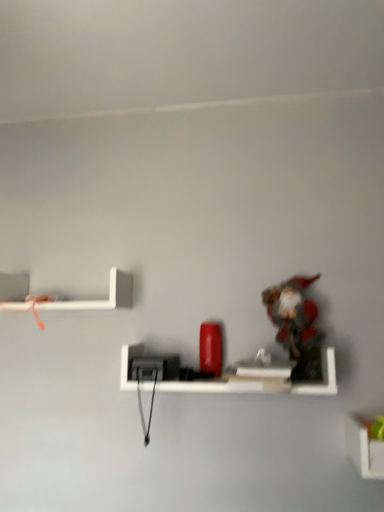
What do you see at coordinates (261, 383) in the screenshot?
I see `matte black shelf at center, which ranks as the second shelf in left-to-right order` at bounding box center [261, 383].

Locate an element on the screen. The image size is (384, 512). white matte shelf at lower right, which ranks as the 1th shelf in bottom-to-top order is located at coordinates (364, 448).

I want to click on white matte shelf at upper left, positioned as the 1th shelf in top-to-bottom order, so click(85, 300).

I want to click on matte black shelf at center, which ranks as the second shelf in left-to-right order, so click(x=261, y=383).

Can you confirm if white matte shelf at lower right, which appears as the 3th shelf when viewed from the top, is thinner than white matte shelf at upper left, positioned as the 1th shelf in top-to-bottom order?

Yes.

Is white matte shelf at lower right, which ranks as the 1th shelf in bottom-to-top order, not inside white matte shelf at upper left, positioned as the 1th shelf in top-to-bottom order?

Indeed, white matte shelf at lower right, which ranks as the 1th shelf in bottom-to-top order, is completely outside white matte shelf at upper left, positioned as the 1th shelf in top-to-bottom order.

Is point (351, 424) closer or farther from the camera than point (119, 277)?

Point (351, 424) appears to be closer to the viewer than point (119, 277).

Looking at this image, can you confirm if white matte shelf at lower right, which is counted as the third shelf, starting from the left, is positioned to the right of white matte shelf at upper left, positioned as the 1th shelf in top-to-bottom order?

Indeed, white matte shelf at lower right, which is counted as the third shelf, starting from the left, is positioned on the right side of white matte shelf at upper left, positioned as the 1th shelf in top-to-bottom order.

Considering the sizes of objects fuzzy fabric toy at right and matte black shelf at center, marked as the second shelf in a right-to-left arrangement, in the image provided, who is taller, fuzzy fabric toy at right or matte black shelf at center, marked as the second shelf in a right-to-left arrangement,?

fuzzy fabric toy at right is taller.

Relative to matte black shelf at center, which appears as the second shelf when viewed from the top, is fuzzy fabric toy at right in front or behind?

In the image, fuzzy fabric toy at right appears behind matte black shelf at center, which appears as the second shelf when viewed from the top.

This screenshot has width=384, height=512. What are the coordinates of `toy above the matte black shelf at center, which appears as the second shelf when viewed from the top (from the image's perspective)` in the screenshot? It's located at (296, 325).

Are fuzzy fabric toy at right and matte black shelf at center, marked as the second shelf in a right-to-left arrangement, making contact?

They are not placed beside each other.

Locate an element on the screen. This screenshot has width=384, height=512. shelf that is the 2nd one when counting forward from the fuzzy fabric toy at right is located at coordinates (364, 448).

Which is closer to the camera, (357, 440) or (316, 365)?

The point (357, 440) is closer.

From the image's perspective, is white matte shelf at lower right, the first shelf when ordered from right to left, positioned above or below fuzzy fabric toy at right?

white matte shelf at lower right, the first shelf when ordered from right to left, is situated lower than fuzzy fabric toy at right in the image.

Which of these two, matte black shelf at center, marked as the second shelf in a right-to-left arrangement, or white matte shelf at upper left, the 3th shelf positioned from the bottom, stands taller?

Standing taller between the two is white matte shelf at upper left, the 3th shelf positioned from the bottom.

Is matte black shelf at center, which ranks as the second shelf in left-to-right order, positioned far away from white matte shelf at upper left, positioned as the 1th shelf in top-to-bottom order?

No, matte black shelf at center, which ranks as the second shelf in left-to-right order, is not far from white matte shelf at upper left, positioned as the 1th shelf in top-to-bottom order.

Which is more distant, (228,382) or (105,304)?

Point (105,304)

From a real-world perspective, between matte black shelf at center, which appears as the second shelf when viewed from the top, and white matte shelf at upper left, which is the 3th shelf in right-to-left order, who is vertically higher?

white matte shelf at upper left, which is the 3th shelf in right-to-left order, is physically above.

Who is more distant, white matte shelf at upper left, the 3th shelf positioned from the bottom, or white matte shelf at lower right, the first shelf when ordered from right to left?

white matte shelf at upper left, the 3th shelf positioned from the bottom, is further from the camera.

Considering the relative positions of white matte shelf at upper left, which is the 3th shelf in right-to-left order, and white matte shelf at lower right, which is counted as the third shelf, starting from the left, in the image provided, is white matte shelf at upper left, which is the 3th shelf in right-to-left order, to the left or to the right of white matte shelf at lower right, which is counted as the third shelf, starting from the left,?

white matte shelf at upper left, which is the 3th shelf in right-to-left order, is positioned on white matte shelf at lower right, which is counted as the third shelf, starting from the left,'s left side.

From a real-world perspective, does white matte shelf at upper left, which is the 3th shelf in right-to-left order, stand above white matte shelf at lower right, which ranks as the 1th shelf in bottom-to-top order?

Result: Yes, from a real-world perspective, white matte shelf at upper left, which is the 3th shelf in right-to-left order, is over white matte shelf at lower right, which ranks as the 1th shelf in bottom-to-top order

Can you tell me how much fuzzy fabric toy at right and white matte shelf at lower right, which appears as the 3th shelf when viewed from the top, differ in facing direction?

0.189 degrees separate the facing orientations of fuzzy fabric toy at right and white matte shelf at lower right, which appears as the 3th shelf when viewed from the top.

From a real-world perspective, which object stands above the other?

fuzzy fabric toy at right, from a real-world perspective.

Considering the sizes of objects fuzzy fabric toy at right and white matte shelf at lower right, which is counted as the third shelf, starting from the left, in the image provided, who is thinner, fuzzy fabric toy at right or white matte shelf at lower right, which is counted as the third shelf, starting from the left,?

fuzzy fabric toy at right is thinner.

How far apart are fuzzy fabric toy at right and white matte shelf at lower right, which appears as the 3th shelf when viewed from the top?

The distance of fuzzy fabric toy at right from white matte shelf at lower right, which appears as the 3th shelf when viewed from the top, is 11.31 inches.

From a real-world perspective, is matte black shelf at center, which appears as the second shelf when viewed from the top, above or below fuzzy fabric toy at right?

In terms of real-world spatial position, matte black shelf at center, which appears as the second shelf when viewed from the top, is below fuzzy fabric toy at right.

Is fuzzy fabric toy at right a part of matte black shelf at center, which appears as the 2th shelf when ordered from the bottom?

No, fuzzy fabric toy at right is not surrounded by matte black shelf at center, which appears as the 2th shelf when ordered from the bottom.

Is matte black shelf at center, which ranks as the second shelf in left-to-right order, directly adjacent to fuzzy fabric toy at right?

No, matte black shelf at center, which ranks as the second shelf in left-to-right order, is not beside fuzzy fabric toy at right.

Identify the location of the 1st shelf in front of the fuzzy fabric toy at right, counting from the anchor's position. (261, 383).

This screenshot has width=384, height=512. What are the coordinates of `the 2nd shelf behind the white matte shelf at lower right, which is counted as the third shelf, starting from the left` in the screenshot? It's located at (85, 300).

Locate an element on the screen. toy to the right of matte black shelf at center, which appears as the second shelf when viewed from the top is located at coordinates tap(296, 325).

Based on their spatial positions, is fuzzy fabric toy at right or white matte shelf at upper left, positioned as the 1th shelf in top-to-bottom order, further from white matte shelf at lower right, which appears as the 3th shelf when viewed from the top?

The object further to white matte shelf at lower right, which appears as the 3th shelf when viewed from the top, is white matte shelf at upper left, positioned as the 1th shelf in top-to-bottom order.

Estimate the real-world distances between objects in this image. Which object is closer to fuzzy fabric toy at right, white matte shelf at lower right, which appears as the 3th shelf when viewed from the top, or matte black shelf at center, which appears as the 2th shelf when ordered from the bottom?

Among the two, matte black shelf at center, which appears as the 2th shelf when ordered from the bottom, is located nearer to fuzzy fabric toy at right.

Based on their spatial positions, is matte black shelf at center, which appears as the second shelf when viewed from the top, or fuzzy fabric toy at right further from white matte shelf at upper left, acting as the 1th shelf starting from the left?

Among the two, fuzzy fabric toy at right is located further to white matte shelf at upper left, acting as the 1th shelf starting from the left.

Looking at the image, which one is located closer to matte black shelf at center, which appears as the second shelf when viewed from the top, white matte shelf at upper left, the 3th shelf positioned from the bottom, or white matte shelf at lower right, which is counted as the third shelf, starting from the left?

Among the two, white matte shelf at lower right, which is counted as the third shelf, starting from the left, is located nearer to matte black shelf at center, which appears as the second shelf when viewed from the top.

Considering their positions, is white matte shelf at lower right, which appears as the 3th shelf when viewed from the top, positioned closer to white matte shelf at upper left, which is the 3th shelf in right-to-left order, than fuzzy fabric toy at right?

fuzzy fabric toy at right.

From the image, which object appears to be farther from matte black shelf at center, which ranks as the second shelf in left-to-right order, white matte shelf at upper left, positioned as the 1th shelf in top-to-bottom order, or fuzzy fabric toy at right?

white matte shelf at upper left, positioned as the 1th shelf in top-to-bottom order, is positioned further to the anchor matte black shelf at center, which ranks as the second shelf in left-to-right order.

Considering their positions, is fuzzy fabric toy at right positioned further to white matte shelf at upper left, acting as the 1th shelf starting from the left, than white matte shelf at lower right, which appears as the 3th shelf when viewed from the top?

Among the two, white matte shelf at lower right, which appears as the 3th shelf when viewed from the top, is located further to white matte shelf at upper left, acting as the 1th shelf starting from the left.

Which object lies further to the anchor point white matte shelf at upper left, positioned as the 1th shelf in top-to-bottom order, fuzzy fabric toy at right or matte black shelf at center, which appears as the 2th shelf when ordered from the bottom?

Among the two, fuzzy fabric toy at right is located further to white matte shelf at upper left, positioned as the 1th shelf in top-to-bottom order.

This screenshot has height=512, width=384. In order to click on shelf between white matte shelf at upper left, the 3th shelf positioned from the bottom, and white matte shelf at lower right, which appears as the 3th shelf when viewed from the top, in the horizontal direction in this screenshot , I will do `click(261, 383)`.

Image resolution: width=384 pixels, height=512 pixels. Find the location of `toy located between white matte shelf at upper left, acting as the 1th shelf starting from the left, and white matte shelf at lower right, which appears as the 3th shelf when viewed from the top, in the left-right direction`. toy located between white matte shelf at upper left, acting as the 1th shelf starting from the left, and white matte shelf at lower right, which appears as the 3th shelf when viewed from the top, in the left-right direction is located at coordinates (296, 325).

The image size is (384, 512). In order to click on toy between matte black shelf at center, marked as the second shelf in a right-to-left arrangement, and white matte shelf at lower right, which is counted as the third shelf, starting from the left, from left to right in this screenshot , I will do `click(296, 325)`.

Locate an element on the screen. The height and width of the screenshot is (512, 384). shelf between white matte shelf at upper left, acting as the 1th shelf starting from the left, and fuzzy fabric toy at right is located at coordinates (261, 383).